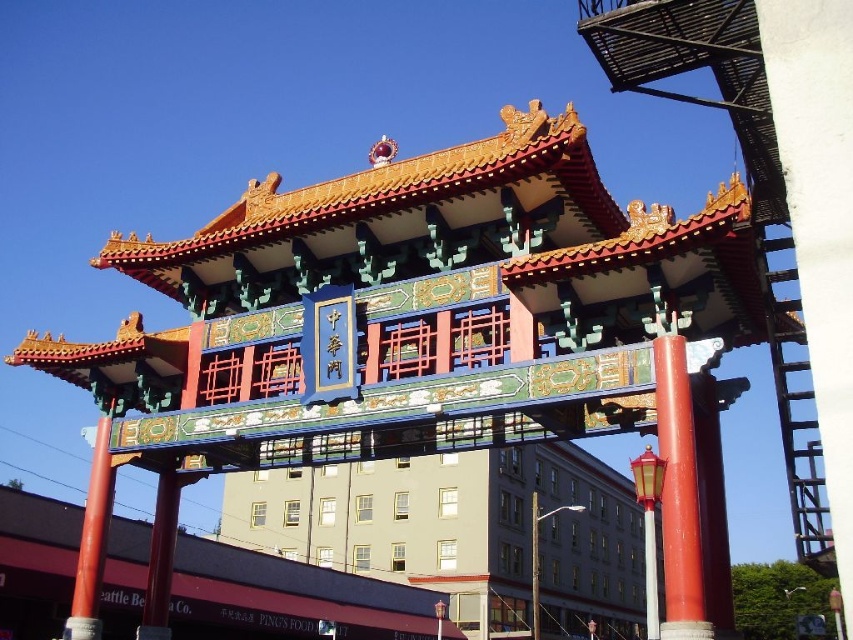
Question: Which point is closer to the camera?

Choices:
 (A) (91, 477)
 (B) (670, 627)

Answer: (B)

Question: Is smooth glossy red pillar at center thinner than smooth red pole at left?

Choices:
 (A) yes
 (B) no

Answer: (A)

Question: Which point is farther from the camera taking this photo?

Choices:
 (A) (672, 513)
 (B) (85, 538)

Answer: (B)

Question: Is smooth glossy red pillar at center bigger than smooth red pole at left?

Choices:
 (A) yes
 (B) no

Answer: (B)

Question: From the image, what is the correct spatial relationship of smooth glossy red pillar at center in relation to smooth red pole at left?

Choices:
 (A) right
 (B) left

Answer: (A)